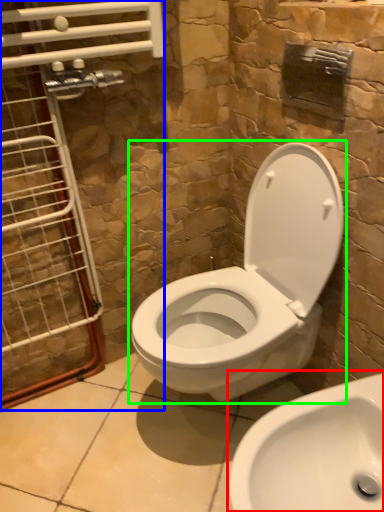
Question: Which object is the closest to the sink (highlighted by a red box)? Choose among these: glass door (highlighted by a blue box) or toilet (highlighted by a green box).

Choices:
 (A) glass door
 (B) toilet

Answer: (B)